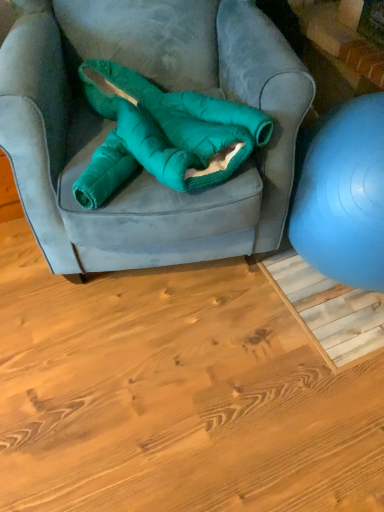
The height and width of the screenshot is (512, 384). What are the coordinates of `blue rubber ball at right` in the screenshot? It's located at (342, 194).

This screenshot has height=512, width=384. What do you see at coordinates (342, 194) in the screenshot?
I see `blue rubber ball at right` at bounding box center [342, 194].

What do you see at coordinates (163, 134) in the screenshot? This screenshot has width=384, height=512. I see `teal plush bean bag at center` at bounding box center [163, 134].

Where is `teal plush bean bag at center`? teal plush bean bag at center is located at coordinates (163, 134).

This screenshot has width=384, height=512. In order to click on blue rubber ball at right in this screenshot , I will do `click(342, 194)`.

Which is more to the left, teal plush bean bag at center or blue rubber ball at right?

From the viewer's perspective, teal plush bean bag at center appears more on the left side.

Considering their positions, is teal plush bean bag at center located in front of or behind blue rubber ball at right?

teal plush bean bag at center is positioned farther from the viewer than blue rubber ball at right.

Considering the positions of point (260, 130) and point (307, 130), is point (260, 130) closer or farther from the camera than point (307, 130)?

Point (260, 130).

From the image's perspective, is teal plush bean bag at center located above or below blue rubber ball at right?

teal plush bean bag at center is above blue rubber ball at right.

From a real-world perspective, does teal plush bean bag at center sit lower than blue rubber ball at right?

No, from a real-world perspective, teal plush bean bag at center is not below blue rubber ball at right.

Which object is thinner, teal plush bean bag at center or blue rubber ball at right?

teal plush bean bag at center is thinner.

Which of these two, teal plush bean bag at center or blue rubber ball at right, stands shorter?

teal plush bean bag at center.

Is teal plush bean bag at center bigger than blue rubber ball at right?

Incorrect, teal plush bean bag at center is not larger than blue rubber ball at right.

In the scene shown: Is teal plush bean bag at center completely or partially outside of blue rubber ball at right?

Yes, teal plush bean bag at center is outside of blue rubber ball at right.

Are teal plush bean bag at center and blue rubber ball at right beside each other?

No.

Is teal plush bean bag at center looking in the opposite direction of blue rubber ball at right?

No.

How different are the orientations of teal plush bean bag at center and blue rubber ball at right in degrees?

The angular difference between teal plush bean bag at center and blue rubber ball at right is 0.899 degrees.

How far apart are teal plush bean bag at center and blue rubber ball at right?

teal plush bean bag at center and blue rubber ball at right are 12.76 inches apart from each other.

Locate an element on the screen. The height and width of the screenshot is (512, 384). bean bag chair above the blue rubber ball at right (from a real-world perspective) is located at coordinates (163, 134).

Considering the relative positions of blue rubber ball at right and teal plush bean bag at center in the image provided, is blue rubber ball at right to the right of teal plush bean bag at center from the viewer's perspective?

Indeed, blue rubber ball at right is positioned on the right side of teal plush bean bag at center.

Which object is more forward, blue rubber ball at right or teal plush bean bag at center?

blue rubber ball at right is more forward.

Is point (343, 188) less distant than point (145, 93)?

Yes, it is in front of point (145, 93).

Looking at this image, from the image's perspective, is blue rubber ball at right on top of teal plush bean bag at center?

No.

From a real-world perspective, is blue rubber ball at right on teal plush bean bag at center?

No, from a real-world perspective, blue rubber ball at right is not on top of teal plush bean bag at center.

Considering the relative sizes of blue rubber ball at right and teal plush bean bag at center in the image provided, is blue rubber ball at right thinner than teal plush bean bag at center?

No, blue rubber ball at right is not thinner than teal plush bean bag at center.

Which of these two, blue rubber ball at right or teal plush bean bag at center, stands shorter?

teal plush bean bag at center.

Considering the sizes of objects blue rubber ball at right and teal plush bean bag at center in the image provided, who is bigger, blue rubber ball at right or teal plush bean bag at center?

blue rubber ball at right is bigger.

Is blue rubber ball at right not inside teal plush bean bag at center?

Yes, blue rubber ball at right is located beyond the bounds of teal plush bean bag at center.

Is blue rubber ball at right directly adjacent to teal plush bean bag at center?

No.

Is blue rubber ball at right turned away from teal plush bean bag at center?

blue rubber ball at right does not have its back to teal plush bean bag at center.

How different are the orientations of blue rubber ball at right and teal plush bean bag at center in degrees?

There is a 0.899-degree angle between the facing directions of blue rubber ball at right and teal plush bean bag at center.

In order to click on bean bag chair located behind the blue rubber ball at right in this screenshot , I will do `click(163, 134)`.

Locate an element on the screen. This screenshot has height=512, width=384. bean bag chair above the blue rubber ball at right (from the image's perspective) is located at coordinates (163, 134).

Find the location of a particular element. The width and height of the screenshot is (384, 512). ball lying on the right of teal plush bean bag at center is located at coordinates (342, 194).